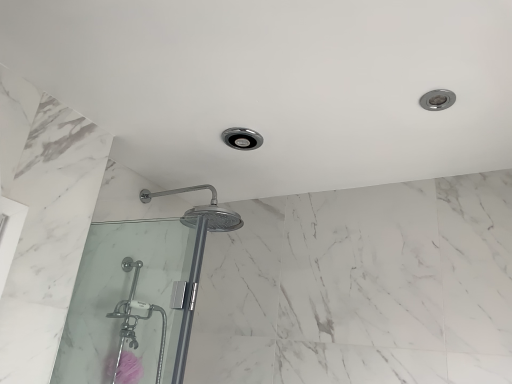
Question: Would you say clear glass shower door at lower left is to the left or to the right of pink matte flower at lower left in the picture?

Choices:
 (A) left
 (B) right

Answer: (B)

Question: Is clear glass shower door at lower left taller or shorter than pink matte flower at lower left?

Choices:
 (A) short
 (B) tall

Answer: (B)

Question: In the image, is clear glass shower door at lower left positioned in front of or behind pink matte flower at lower left?

Choices:
 (A) front
 (B) behind

Answer: (A)

Question: Considering the positions of pink matte flower at lower left and clear glass shower door at lower left in the image, is pink matte flower at lower left taller or shorter than clear glass shower door at lower left?

Choices:
 (A) short
 (B) tall

Answer: (A)

Question: From a real-world perspective, is pink matte flower at lower left physically located above or below clear glass shower door at lower left?

Choices:
 (A) below
 (B) above

Answer: (A)

Question: In terms of width, does pink matte flower at lower left look wider or thinner when compared to clear glass shower door at lower left?

Choices:
 (A) thin
 (B) wide

Answer: (B)

Question: Considering their positions, is pink matte flower at lower left located in front of or behind clear glass shower door at lower left?

Choices:
 (A) front
 (B) behind

Answer: (B)